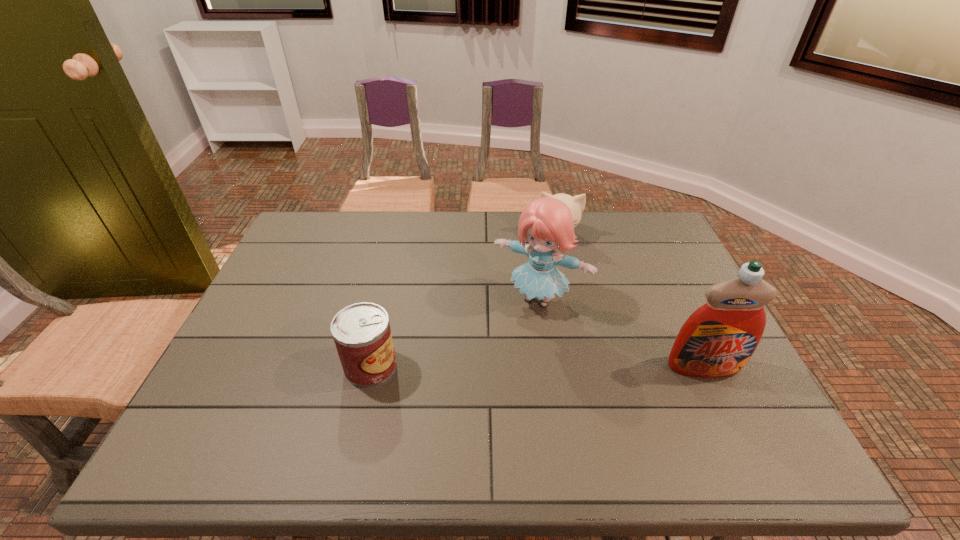
The image size is (960, 540). I want to click on vacant space on the desktop that is between the can and the rightmost object and is positioned on the face of the farthest object, so click(564, 366).

The width and height of the screenshot is (960, 540). I want to click on free space on the desktop that is between the leftmost object and the rightmost object and is positioned on the front-facing side of the doll, so click(x=499, y=366).